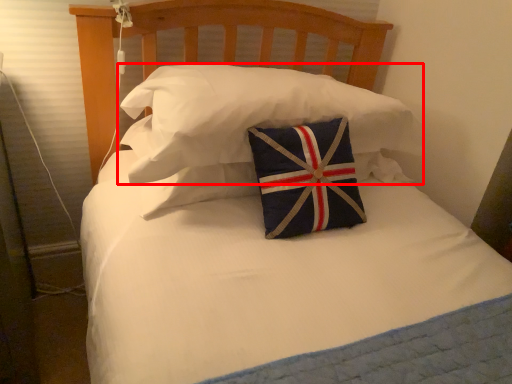
Question: From the image's perspective, what is the correct spatial positioning of pillow (annotated by the red box) in reference to pillow?

Choices:
 (A) below
 (B) above

Answer: (B)